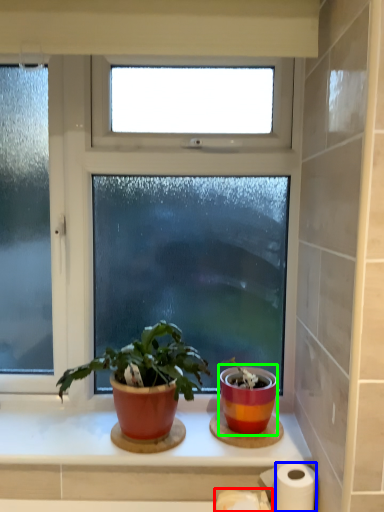
Question: Estimate the real-world distances between objects in this image. Which object is closer to toilet paper (highlighted by a red box), paper towel (highlighted by a blue box) or flowerpot (highlighted by a green box)?

Choices:
 (A) paper towel
 (B) flowerpot

Answer: (A)